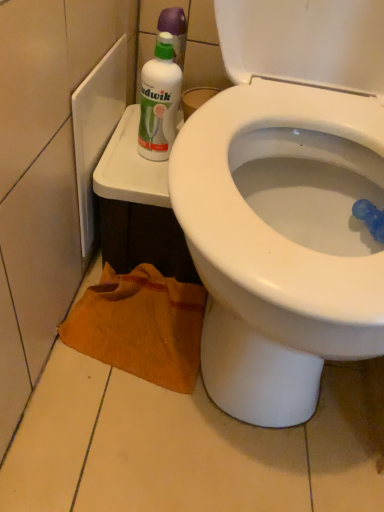
At what (x,y) coordinates should I click in order to perform the action: click on white plastic bottle at upper left. Please return your answer as a coordinate pair (x, y). Looking at the image, I should click on (159, 101).

The width and height of the screenshot is (384, 512). I want to click on brown fabric towel at lower left, so click(x=140, y=326).

In the scene shown: Is white plastic bottle at upper left outside of white glossy bidet at upper right?

Absolutely, white plastic bottle at upper left is external to white glossy bidet at upper right.

Considering the relative positions of white plastic bottle at upper left and white glossy bidet at upper right in the image provided, is white plastic bottle at upper left behind white glossy bidet at upper right?

Yes, it is behind white glossy bidet at upper right.

Locate an element on the screen. This screenshot has height=512, width=384. bidet below the white plastic bottle at upper left (from a real-world perspective) is located at coordinates (280, 241).

Between white plastic bottle at upper left and white glossy bidet at upper right, which one has less height?

white plastic bottle at upper left is shorter.

From a real-world perspective, relative to white glossy bidet at upper right, is brown fabric towel at lower left vertically above or below?

In terms of real-world spatial position, brown fabric towel at lower left is below white glossy bidet at upper right.

What's the angular difference between brown fabric towel at lower left and white glossy bidet at upper right's facing directions?

There is a 0.00122-degree angle between the facing directions of brown fabric towel at lower left and white glossy bidet at upper right.

Is brown fabric towel at lower left not within white glossy bidet at upper right?

Actually, brown fabric towel at lower left is at least partially inside white glossy bidet at upper right.

Who is smaller, brown fabric towel at lower left or white glossy bidet at upper right?

With smaller size is brown fabric towel at lower left.

Is white glossy bidet at upper right oriented towards brown fabric towel at lower left?

No, white glossy bidet at upper right does not turn towards brown fabric towel at lower left.

Which is correct: white glossy bidet at upper right is inside brown fabric towel at lower left, or outside of it?

white glossy bidet at upper right cannot be found inside brown fabric towel at lower left.

This screenshot has height=512, width=384. In order to click on material that appears behind the white glossy bidet at upper right in this screenshot , I will do `click(140, 326)`.

Is white glossy bidet at upper right bigger or smaller than brown fabric towel at lower left?

In the image, white glossy bidet at upper right appears to be larger than brown fabric towel at lower left.

Is white plastic bottle at upper left placed right next to brown fabric towel at lower left?

No, white plastic bottle at upper left is not beside brown fabric towel at lower left.

In the scene shown: From a real-world perspective, which object rests below the other?

brown fabric towel at lower left.

Is white plastic bottle at upper left aimed at brown fabric towel at lower left?

No, white plastic bottle at upper left is not turned towards brown fabric towel at lower left.

In order to click on cleaning product that appears above the white glossy bidet at upper right (from a real-world perspective) in this screenshot , I will do `click(159, 101)`.

Which is closer, (264,292) or (156,112)?

Point (264,292) is closer to the camera than point (156,112).

Would you say white glossy bidet at upper right is outside white plastic bottle at upper left?

That's correct, white glossy bidet at upper right is outside of white plastic bottle at upper left.

Which of these two, white glossy bidet at upper right or white plastic bottle at upper left, is wider?

white glossy bidet at upper right.

Is brown fabric towel at lower left outside of white plastic bottle at upper left?

That's correct, brown fabric towel at lower left is outside of white plastic bottle at upper left.

How different are the orientations of brown fabric towel at lower left and white plastic bottle at upper left in degrees?

They differ by 0.00153 degrees in their facing directions.

This screenshot has height=512, width=384. I want to click on cleaning product in front of the brown fabric towel at lower left, so click(159, 101).

Which is less distant, (81, 304) or (170, 126)?

Point (81, 304).

Find the location of a particular element. cleaning product behind the white glossy bidet at upper right is located at coordinates (159, 101).

I want to click on material that is on the left side of white glossy bidet at upper right, so click(140, 326).

From the image, which object appears to be nearer to white plastic bottle at upper left, brown fabric towel at lower left or white glossy bidet at upper right?

Among the two, white glossy bidet at upper right is located nearer to white plastic bottle at upper left.

From the image, which object appears to be farther from white glossy bidet at upper right, white plastic bottle at upper left or brown fabric towel at lower left?

Based on the image, white plastic bottle at upper left appears to be further to white glossy bidet at upper right.

Estimate the real-world distances between objects in this image. Which object is closer to white plastic bottle at upper left, white glossy bidet at upper right or brown fabric towel at lower left?

white glossy bidet at upper right is closer to white plastic bottle at upper left.

Looking at this image, looking at the image, which one is located further to brown fabric towel at lower left, white glossy bidet at upper right or white plastic bottle at upper left?

white plastic bottle at upper left is further to brown fabric towel at lower left.

Looking at the image, which one is located closer to brown fabric towel at lower left, white plastic bottle at upper left or white glossy bidet at upper right?

white glossy bidet at upper right lies closer to brown fabric towel at lower left than the other object.

From the image, which object appears to be nearer to white glossy bidet at upper right, brown fabric towel at lower left or white plastic bottle at upper left?

brown fabric towel at lower left is closer to white glossy bidet at upper right.

Identify the location of cleaning product between white glossy bidet at upper right and brown fabric towel at lower left along the z-axis. click(x=159, y=101).